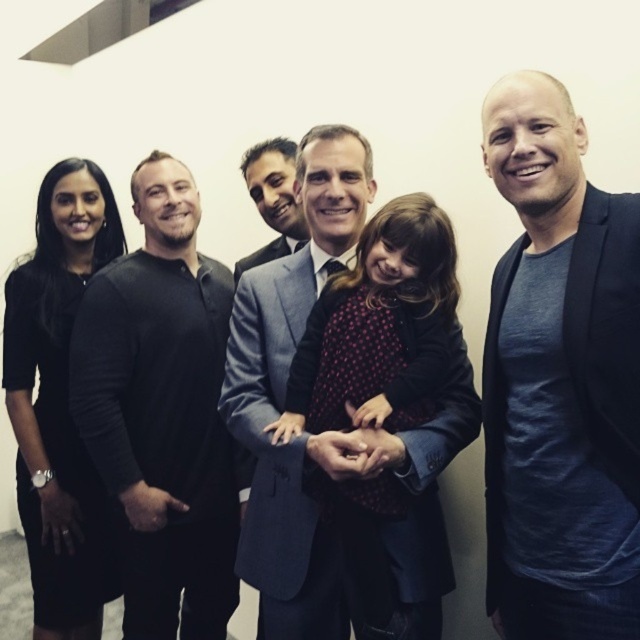
Question: Among these points, which one is farthest from the camera?

Choices:
 (A) (76, 362)
 (B) (36, 310)
 (C) (618, 252)

Answer: (B)

Question: Among these points, which one is nearest to the camera?

Choices:
 (A) (218, 337)
 (B) (54, 355)
 (C) (269, 243)

Answer: (A)

Question: Can you confirm if black matte shirt at left is positioned to the left of gray wool suit at center?

Choices:
 (A) yes
 (B) no

Answer: (A)

Question: Does polka dot fabric dress at center have a smaller size compared to gray suit at center?

Choices:
 (A) yes
 (B) no

Answer: (B)

Question: Considering the real-world distances, which object is closest to the dark blue t-shirt at center?

Choices:
 (A) dark gray suit at center
 (B) gray wool suit at center
 (C) polka dot fabric dress at center
 (D) black matte shirt at left

Answer: (C)

Question: Is the position of dark blue t-shirt at center more distant than that of gray wool suit at center?

Choices:
 (A) yes
 (B) no

Answer: (B)